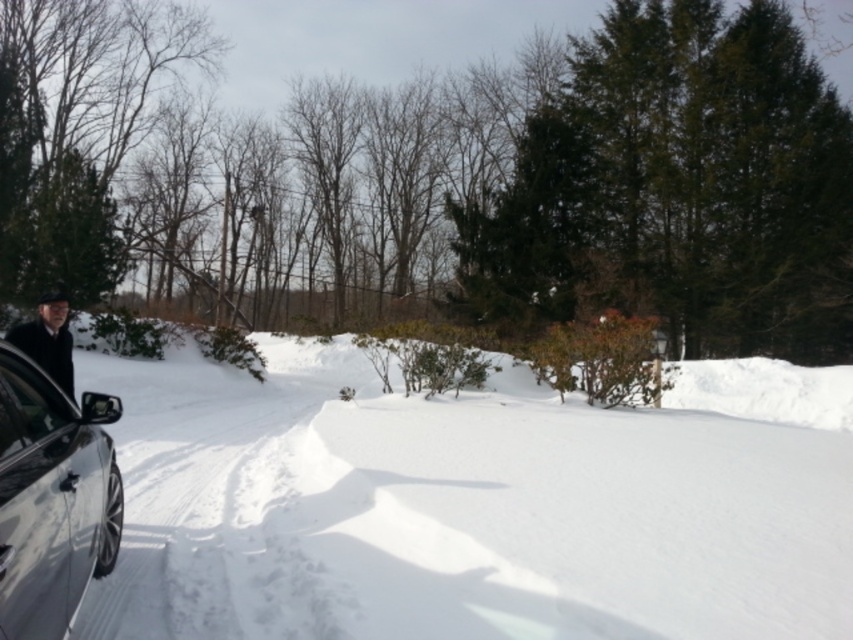
Question: Where is white fluffy snow at lower left located in relation to shiny metallic car at left in the image?

Choices:
 (A) right
 (B) left

Answer: (A)

Question: Can you confirm if clear glass window at lower left is smaller than dark woolen coat at left?

Choices:
 (A) no
 (B) yes

Answer: (A)

Question: Is the position of white fluffy snow at lower left more distant than that of shiny metallic car at left?

Choices:
 (A) yes
 (B) no

Answer: (A)

Question: Which point is closer to the camera taking this photo?

Choices:
 (A) (27, 438)
 (B) (128, 467)
 (C) (22, 403)

Answer: (A)

Question: Estimate the real-world distances between objects in this image. Which object is farther from the dark woolen coat at left?

Choices:
 (A) clear glass window at lower left
 (B) shiny metallic car at left
 (C) white fluffy snow at lower left

Answer: (C)

Question: Based on their relative distances, which object is nearer to the dark woolen coat at left?

Choices:
 (A) clear glass window at lower left
 (B) shiny metallic car at left

Answer: (B)